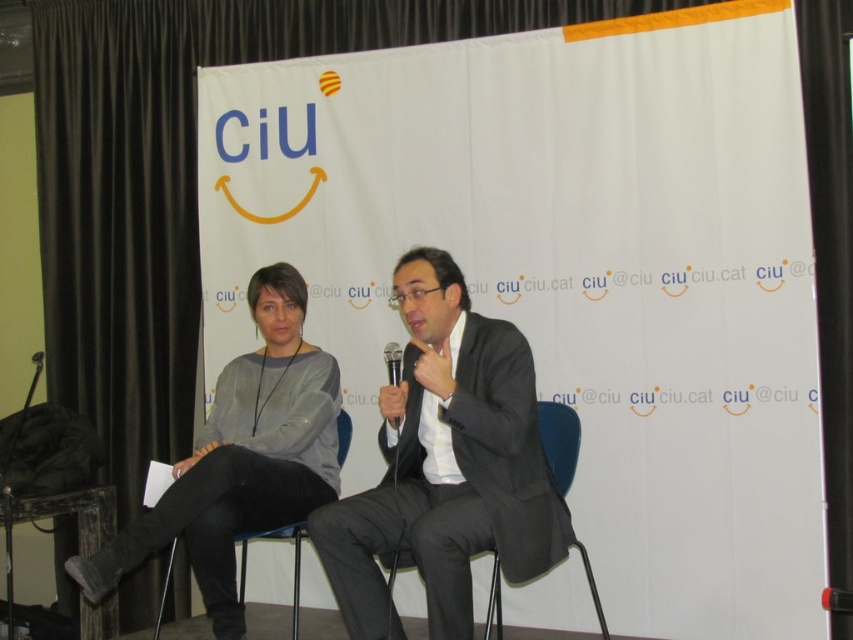
You are a fashion designer analyzing the image. You need to determine if the gray sweater at center can be seen above the blue fabric chair at center when viewed from the front. Based on the description, what is your conclusion?

The gray sweater at center is taller than the blue fabric chair at center, so yes, the gray sweater at center can be seen above the blue fabric chair at center when viewed from the front.

You are a fashion designer observing the scene. You notice the dark gray suit at center and the black plastic chair at lower left. Which object is taller?

The dark gray suit at center is taller than the black plastic chair at lower left.

You are a photographer setting up for a group photo. You see the dark gray suit at center and the black plastic chair at lower left in the scene. Which object is positioned higher in the image?

The dark gray suit at center is located above the black plastic chair at lower left, so it is positioned higher in the image.